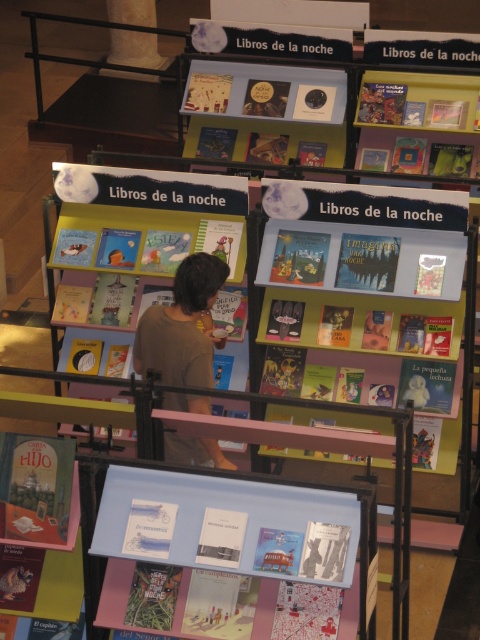
You are a customer looking for a book to read before bedtime. You see the matte yellow book at upper right and the white marble pillar at upper left. Which object is closer to the bottom of the image?

The matte yellow book at upper right is located below the white marble pillar at upper left, so it is closer to the bottom of the image.

Consider the image. You are a customer browsing in the bookstore and notice the brown matte shirt at center and the white marble pillar at upper left. Which object is taller?

The brown matte shirt at center is much taller than the white marble pillar at upper left.

You are a librarian organizing books in the childrens section. You have a matte yellow book at upper right and a white marble pillar at upper left. Which object takes up less space?

The matte yellow book at upper right is smaller than the white marble pillar at upper left, so it takes up less space.